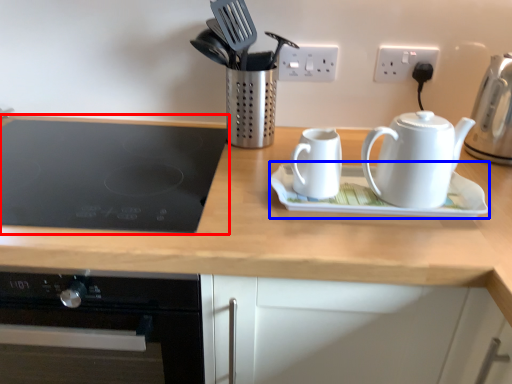
Question: Which of the following is the closest to the observer, gas stove (highlighted by a red box) or saucer (highlighted by a blue box)?

Choices:
 (A) gas stove
 (B) saucer

Answer: (A)